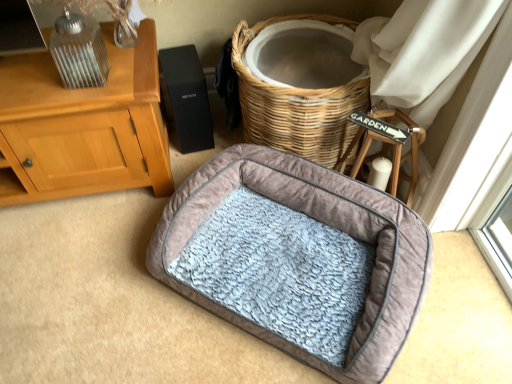
Question: Does velvet-like gray dog bed at center have a smaller size compared to woven wicker basket at center?

Choices:
 (A) no
 (B) yes

Answer: (B)

Question: Is velvet-like gray dog bed at center shorter than woven wicker basket at center?

Choices:
 (A) no
 (B) yes

Answer: (B)

Question: Would you consider velvet-like gray dog bed at center to be distant from woven wicker basket at center?

Choices:
 (A) yes
 (B) no

Answer: (B)

Question: Does velvet-like gray dog bed at center have a larger size compared to woven wicker basket at center?

Choices:
 (A) yes
 (B) no

Answer: (B)

Question: Is velvet-like gray dog bed at center outside woven wicker basket at center?

Choices:
 (A) yes
 (B) no

Answer: (A)

Question: Considering the relative positions of velvet-like gray dog bed at center and woven wicker basket at center in the image provided, is velvet-like gray dog bed at center to the left of woven wicker basket at center from the viewer's perspective?

Choices:
 (A) no
 (B) yes

Answer: (B)

Question: Is woven wicker basket at center bigger than velvet-like gray dog bed at center?

Choices:
 (A) no
 (B) yes

Answer: (B)

Question: Is the depth of woven wicker basket at center less than that of velvet-like gray dog bed at center?

Choices:
 (A) no
 (B) yes

Answer: (A)

Question: Considering the relative sizes of woven wicker basket at center and velvet-like gray dog bed at center in the image provided, is woven wicker basket at center wider than velvet-like gray dog bed at center?

Choices:
 (A) no
 (B) yes

Answer: (A)

Question: Does woven wicker basket at center have a smaller size compared to velvet-like gray dog bed at center?

Choices:
 (A) yes
 (B) no

Answer: (B)

Question: From a real-world perspective, is woven wicker basket at center located higher than velvet-like gray dog bed at center?

Choices:
 (A) no
 (B) yes

Answer: (B)

Question: From a real-world perspective, is woven wicker basket at center physically below velvet-like gray dog bed at center?

Choices:
 (A) yes
 (B) no

Answer: (B)

Question: In terms of width, does velvet-like gray dog bed at center look wider or thinner when compared to woven wicker basket at center?

Choices:
 (A) thin
 (B) wide

Answer: (B)